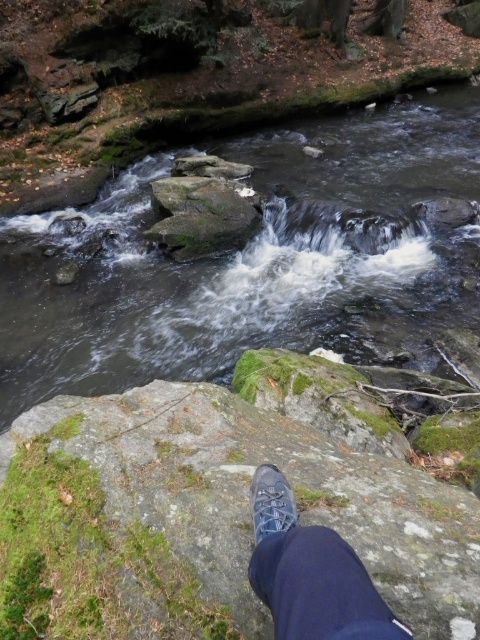
Question: Considering the real-world distances, which object is farthest from the smooth gray rock at center?

Choices:
 (A) blue suede shoe at lower center
 (B) dark blue fabric shoe at lower center

Answer: (B)

Question: Is smooth gray rock at center below dark blue fabric shoe at lower center?

Choices:
 (A) yes
 (B) no

Answer: (B)

Question: Estimate the real-world distances between objects in this image. Which object is closer to the smooth gray rock at center?

Choices:
 (A) blue suede shoe at lower center
 (B) dark blue fabric shoe at lower center

Answer: (A)

Question: Which of the following is the farthest from the observer?

Choices:
 (A) (409, 244)
 (B) (372, 605)
 (C) (255, 483)

Answer: (A)

Question: Observing the image, what is the correct spatial positioning of smooth gray rock at center in reference to blue suede shoe at lower center?

Choices:
 (A) right
 (B) left

Answer: (A)

Question: Does dark blue fabric shoe at lower center have a greater width compared to blue suede shoe at lower center?

Choices:
 (A) no
 (B) yes

Answer: (B)